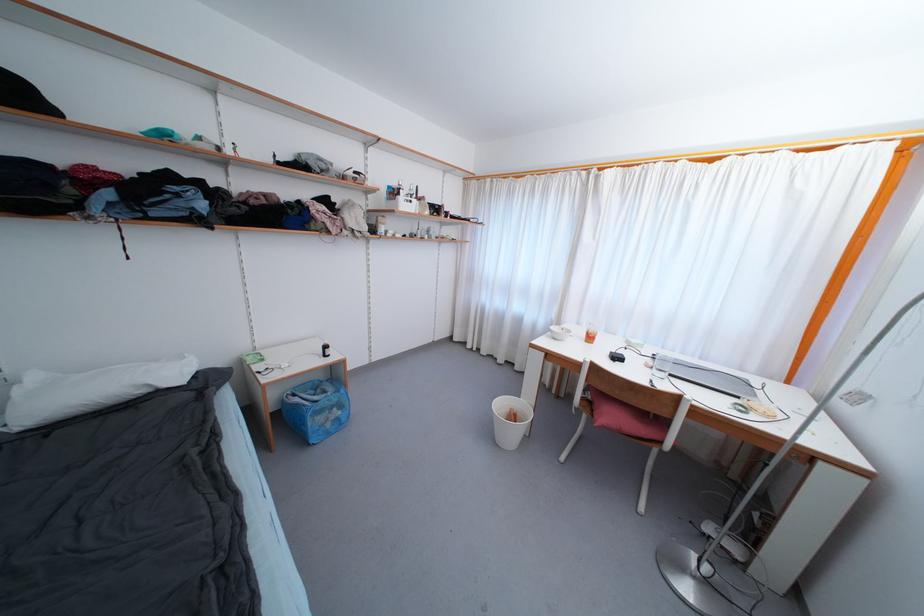
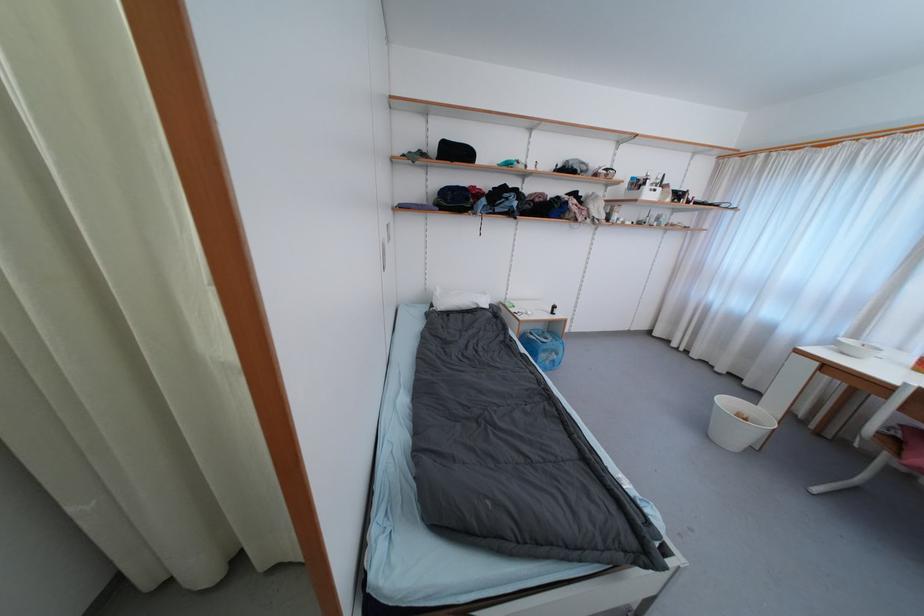
Where in the second image is the point corresponding to the point at 91,169 from the first image?

(478, 190)